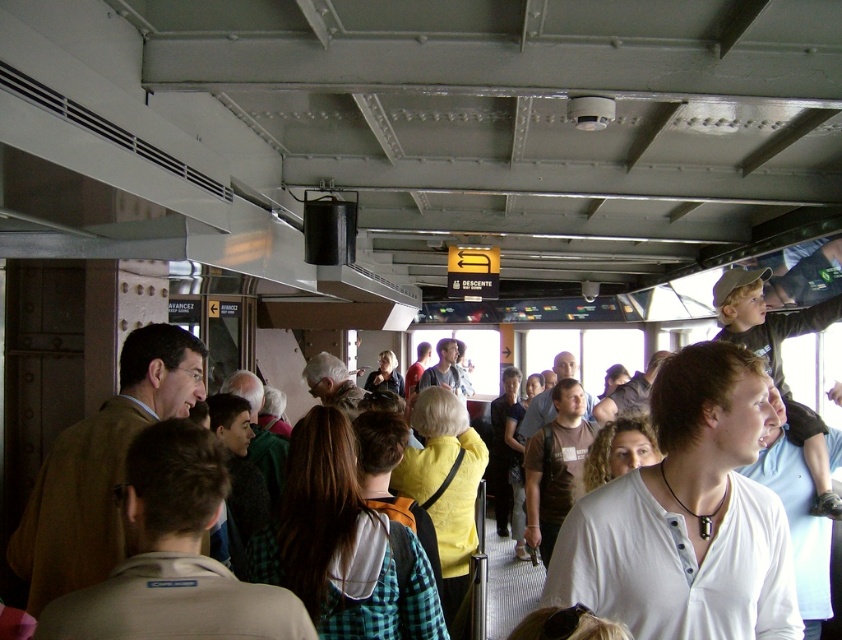
Question: Based on their relative distances, which object is farther from the yellow matte sweater at center?

Choices:
 (A) green plaid shirt at center
 (B) white fabric shirt at lower left
 (C) white matte shirt at center

Answer: (B)

Question: Is yellow shirt at center bigger than yellow fabric shirt at center?

Choices:
 (A) yes
 (B) no

Answer: (A)

Question: Is curly hair at center positioned in front of yellow shirt at center?

Choices:
 (A) no
 (B) yes

Answer: (B)

Question: Which point appears closest to the camera in this image?

Choices:
 (A) (419, 545)
 (B) (717, 538)
 (C) (403, 387)

Answer: (B)

Question: Is green plaid shirt at center further to the viewer compared to yellow shirt at center?

Choices:
 (A) yes
 (B) no

Answer: (B)

Question: Which of these objects is positioned farthest from the white fabric shirt at lower left?

Choices:
 (A) green plaid shirt at center
 (B) white matte shirt at center
 (C) curly hair at center

Answer: (C)